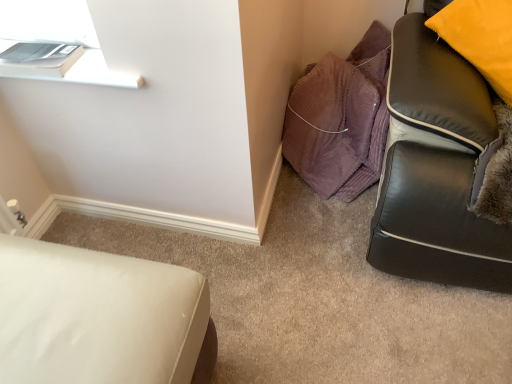
Find the location of `white leather ottoman at lower left`. white leather ottoman at lower left is located at coordinates (96, 316).

What do you see at coordinates (96, 316) in the screenshot? This screenshot has width=512, height=384. I see `white leather ottoman at lower left` at bounding box center [96, 316].

What do you see at coordinates (341, 119) in the screenshot?
I see `purple corduroy pillows at upper right` at bounding box center [341, 119].

I want to click on purple corduroy pillows at upper right, so (341, 119).

Measure the distance between point (373, 24) and camera.

Point (373, 24) is 1.79 meters away from camera.

Where is `white leather ottoman at lower left`? white leather ottoman at lower left is located at coordinates (96, 316).

Considering the positions of objects purple corduroy pillows at upper right and white leather ottoman at lower left in the image provided, who is more to the right, purple corduroy pillows at upper right or white leather ottoman at lower left?

From the viewer's perspective, purple corduroy pillows at upper right appears more on the right side.

Relative to white leather ottoman at lower left, is purple corduroy pillows at upper right in front or behind?

Visually, purple corduroy pillows at upper right is located behind white leather ottoman at lower left.

Is point (343, 180) closer to camera compared to point (5, 259)?

That is False.

From the image's perspective, is purple corduroy pillows at upper right located beneath white leather ottoman at lower left?

No, from the image's perspective, purple corduroy pillows at upper right is not beneath white leather ottoman at lower left.

From a real-world perspective, which is physically below, purple corduroy pillows at upper right or white leather ottoman at lower left?

purple corduroy pillows at upper right.

Between purple corduroy pillows at upper right and white leather ottoman at lower left, which one has larger width?

Wider between the two is white leather ottoman at lower left.

Which of these two, purple corduroy pillows at upper right or white leather ottoman at lower left, stands taller?

white leather ottoman at lower left is taller.

Does purple corduroy pillows at upper right have a smaller size compared to white leather ottoman at lower left?

Indeed, purple corduroy pillows at upper right has a smaller size compared to white leather ottoman at lower left.

Is white leather ottoman at lower left a part of purple corduroy pillows at upper right?

Definitely not — white leather ottoman at lower left is not inside purple corduroy pillows at upper right.

Are purple corduroy pillows at upper right and white leather ottoman at lower left far apart?

That's not correct — purple corduroy pillows at upper right is a little close to white leather ottoman at lower left.

Is purple corduroy pillows at upper right oriented away from white leather ottoman at lower left?

No, purple corduroy pillows at upper right's orientation is not away from white leather ottoman at lower left.

How many degrees apart are the facing directions of purple corduroy pillows at upper right and white leather ottoman at lower left?

A: There is a 91-degree angle between the facing directions of purple corduroy pillows at upper right and white leather ottoman at lower left.

How distant is purple corduroy pillows at upper right from white leather ottoman at lower left?

They are 38.71 inches apart.

Where is `furniture that is above the purple corduroy pillows at upper right (from a real-world perspective)`? The width and height of the screenshot is (512, 384). furniture that is above the purple corduroy pillows at upper right (from a real-world perspective) is located at coordinates (96, 316).

Looking at this image, considering the relative positions of white leather ottoman at lower left and purple corduroy pillows at upper right in the image provided, is white leather ottoman at lower left to the left or to the right of purple corduroy pillows at upper right?

In the image, white leather ottoman at lower left appears on the left side of purple corduroy pillows at upper right.

Is white leather ottoman at lower left closer to camera compared to purple corduroy pillows at upper right?

Yes, white leather ottoman at lower left is in front of purple corduroy pillows at upper right.

Which is farther from the camera, (145, 267) or (360, 57)?

The point (360, 57) is farther from the camera.

From the image's perspective, is white leather ottoman at lower left located beneath purple corduroy pillows at upper right?

Yes, from the image's perspective, white leather ottoman at lower left is beneath purple corduroy pillows at upper right.

From a real-world perspective, is white leather ottoman at lower left below purple corduroy pillows at upper right?

No.

Is white leather ottoman at lower left thinner than purple corduroy pillows at upper right?

No.

Considering the relative sizes of white leather ottoman at lower left and purple corduroy pillows at upper right in the image provided, is white leather ottoman at lower left shorter than purple corduroy pillows at upper right?

Incorrect, the height of white leather ottoman at lower left does not fall short of that of purple corduroy pillows at upper right.

Considering the sizes of objects white leather ottoman at lower left and purple corduroy pillows at upper right in the image provided, who is bigger, white leather ottoman at lower left or purple corduroy pillows at upper right?

white leather ottoman at lower left.

Would you say purple corduroy pillows at upper right is part of white leather ottoman at lower left's contents?

Definitely not — purple corduroy pillows at upper right is not inside white leather ottoman at lower left.

Would you say white leather ottoman at lower left is a long distance from purple corduroy pillows at upper right?

white leather ottoman at lower left is near purple corduroy pillows at upper right, not far away.

Does white leather ottoman at lower left turn towards purple corduroy pillows at upper right?

→ No, white leather ottoman at lower left is not facing towards purple corduroy pillows at upper right.

How far apart are white leather ottoman at lower left and purple corduroy pillows at upper right?

A distance of 38.71 inches exists between white leather ottoman at lower left and purple corduroy pillows at upper right.

Locate an element on the screen. This screenshot has height=384, width=512. material behind the white leather ottoman at lower left is located at coordinates (341, 119).

At what (x,y) coordinates should I click in order to perform the action: click on furniture on the left side of purple corduroy pillows at upper right. Please return your answer as a coordinate pair (x, y). Looking at the image, I should click on (96, 316).

Locate an element on the screen. This screenshot has width=512, height=384. material behind the white leather ottoman at lower left is located at coordinates (341, 119).